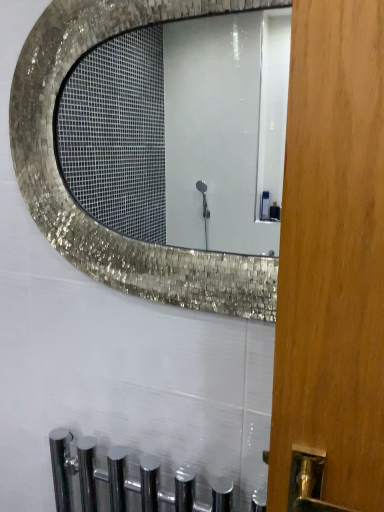
Identify the location of shiny mosaic mirror at upper center. The image size is (384, 512). (181, 131).

What do you see at coordinates (181, 131) in the screenshot? I see `shiny mosaic mirror at upper center` at bounding box center [181, 131].

Image resolution: width=384 pixels, height=512 pixels. What are the coordinates of `shiny mosaic mirror at upper center` in the screenshot? It's located at (181, 131).